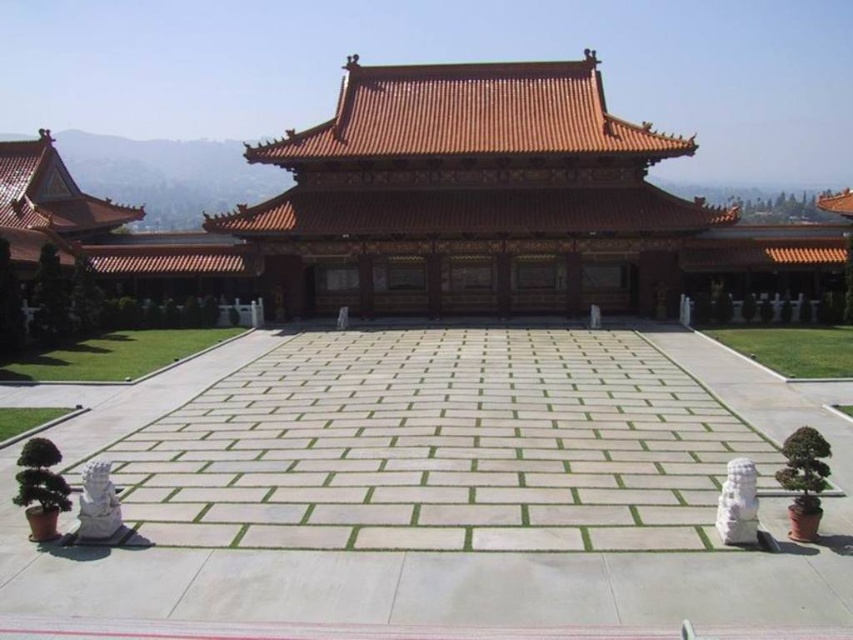
Question: Which point appears closest to the camera in this image?

Choices:
 (A) (20, 422)
 (B) (424, 118)

Answer: (A)

Question: Can you confirm if brown wooden palace at center is bigger than green grass at lower right?

Choices:
 (A) yes
 (B) no

Answer: (A)

Question: Is green grass at lower left to the right of green grass at lower right from the viewer's perspective?

Choices:
 (A) yes
 (B) no

Answer: (B)

Question: Does green grass at lower left have a larger size compared to green grass at lower right?

Choices:
 (A) yes
 (B) no

Answer: (A)

Question: Among these points, which one is nearest to the camera?

Choices:
 (A) (128, 371)
 (B) (844, 356)
 (C) (656, 156)
 (D) (25, 412)

Answer: (D)

Question: Among these points, which one is farthest from the camera?

Choices:
 (A) (544, 97)
 (B) (828, 339)

Answer: (A)